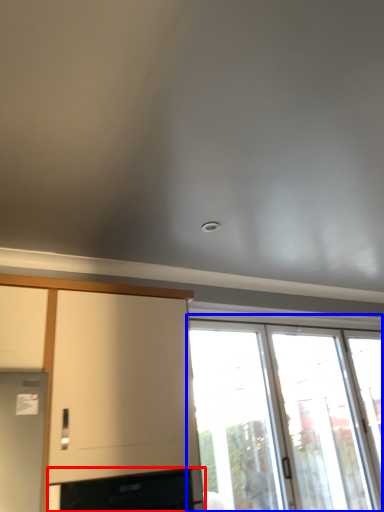
Question: Which object is closer to the camera taking this photo, appliance (highlighted by a red box) or window (highlighted by a blue box)?

Choices:
 (A) appliance
 (B) window

Answer: (A)